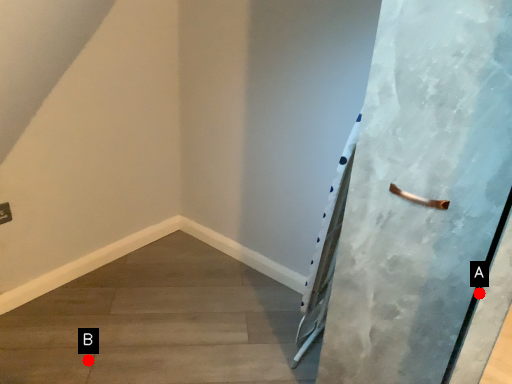
Question: Two points are circled on the image, labeled by A and B beside each circle. Which of the following is the closest to the observer?

Choices:
 (A) A is closer
 (B) B is closer

Answer: (A)